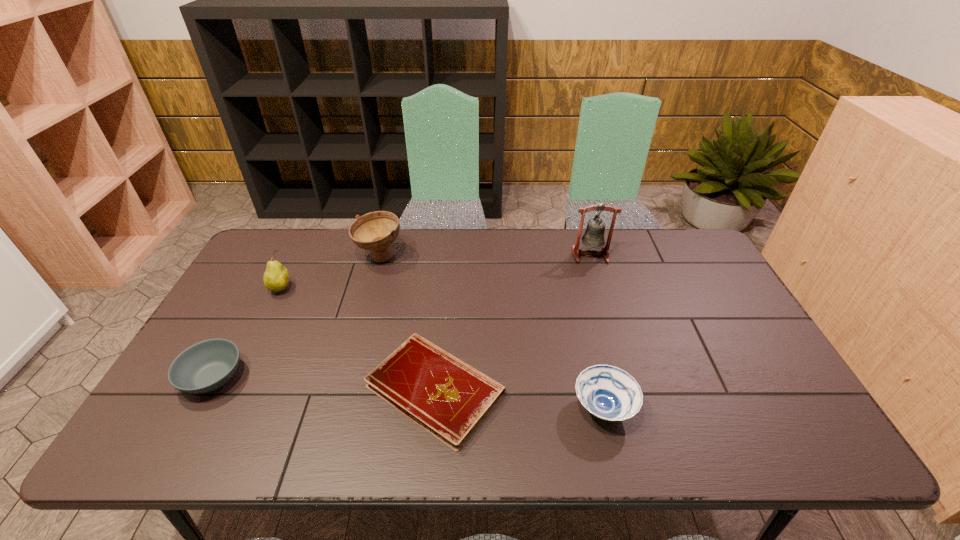
Identify the location of vacant space located 0.290m on the front of the pear. (237, 377).

Where is `free region located 0.310m on the back of the rightmost soup bowl`? This screenshot has height=540, width=960. free region located 0.310m on the back of the rightmost soup bowl is located at coordinates (577, 297).

Locate an element on the screen. free space located 0.090m on the right of the leftmost soup bowl is located at coordinates (280, 377).

This screenshot has height=540, width=960. In order to click on free space located on the right of the shortest object in this screenshot , I will do `click(578, 389)`.

Identify the location of bell that is at the far edge. The height and width of the screenshot is (540, 960). (594, 235).

Where is `soup bowl at the far edge`? soup bowl at the far edge is located at coordinates (376, 231).

Find the location of a particular element. This screenshot has height=540, width=960. soup bowl situated at the near edge is located at coordinates (609, 393).

The image size is (960, 540). Find the location of `notebook situated at the near edge`. notebook situated at the near edge is located at coordinates (448, 398).

I want to click on pear at the left edge, so click(276, 277).

Identify the location of soup bowl at the left edge. This screenshot has height=540, width=960. (206, 366).